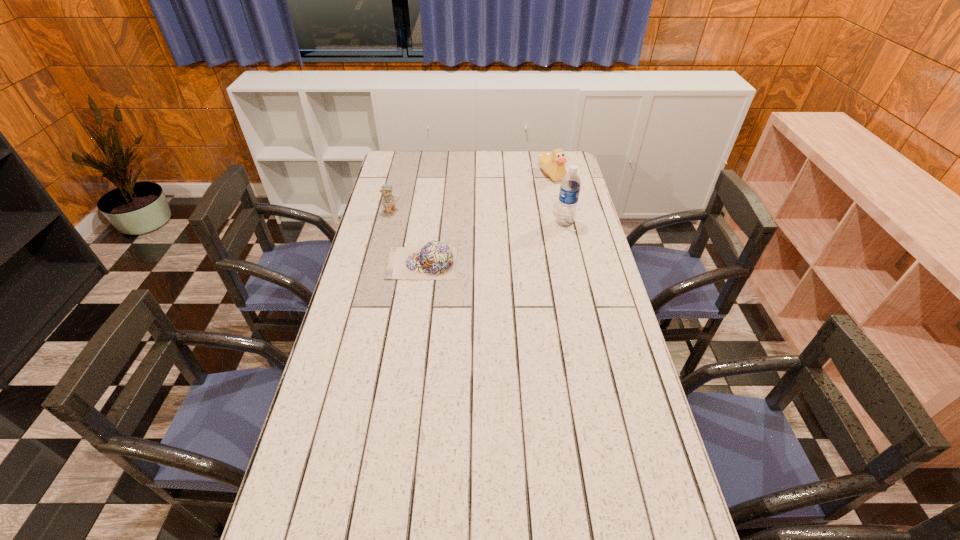
Where is `blank region between the nearest object and the third farthest object`? The width and height of the screenshot is (960, 540). blank region between the nearest object and the third farthest object is located at coordinates (493, 243).

Identify the location of empty space between the teddy bear and the cap. This screenshot has width=960, height=540. (407, 238).

Find the location of `blank region between the second nearest object and the farthest object`. blank region between the second nearest object and the farthest object is located at coordinates (558, 199).

Where is `empty location between the duck and the cap`? empty location between the duck and the cap is located at coordinates point(487,219).

The width and height of the screenshot is (960, 540). Identify the location of empty space between the second farthest object and the duck. (471, 193).

I want to click on blank region between the teddy bear and the duck, so click(x=471, y=193).

Locate an element on the screen. unoccupied position between the duck and the shortest object is located at coordinates (487, 219).

I want to click on object that is the closest to the nearest object, so click(389, 200).

Find the location of a particular element. The image size is (960, 540). object that is the third closest to the teddy bear is located at coordinates (570, 186).